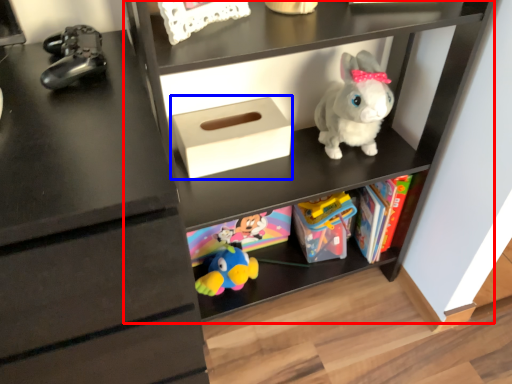
Question: Which object is further to the camera taking this photo, shelf (highlighted by a red box) or shoe box (highlighted by a blue box)?

Choices:
 (A) shelf
 (B) shoe box

Answer: (B)